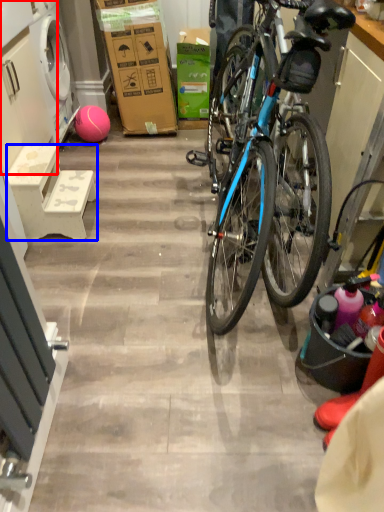
Question: Which of the following is the closest to the observer, cabinetry (highlighted by a red box) or stool (highlighted by a blue box)?

Choices:
 (A) cabinetry
 (B) stool

Answer: (B)